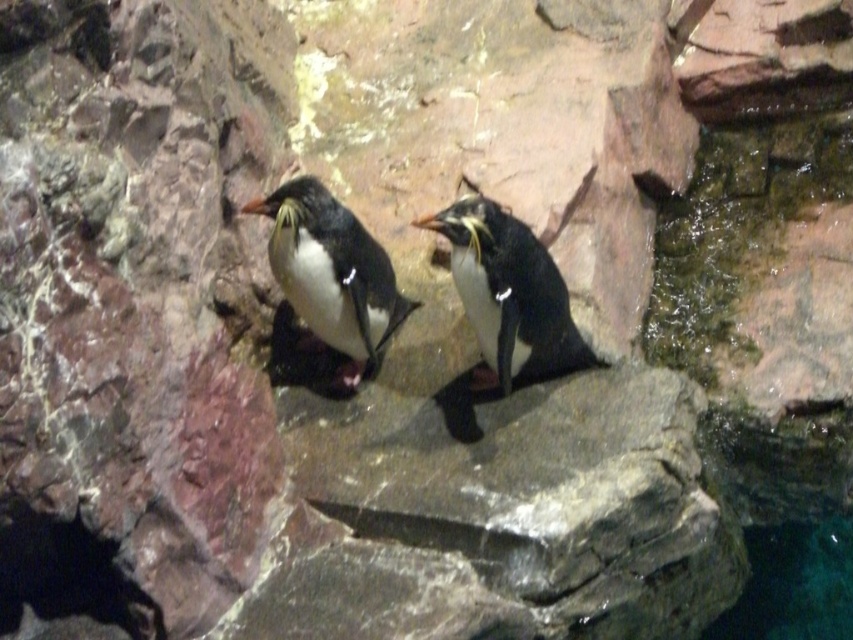
Is point (357, 337) behind point (753, 568)?

No, it is not.

Does white matte penguin at center lie behind clear blue water at lower right?

No, it is in front of clear blue water at lower right.

The width and height of the screenshot is (853, 640). I want to click on white matte penguin at center, so 331,273.

Who is lower down, black matte penguin at center or clear blue water at lower right?

clear blue water at lower right is lower down.

Is point (479, 250) positioned before point (804, 586)?

Yes, it is.

Locate an element on the screen. The width and height of the screenshot is (853, 640). black matte penguin at center is located at coordinates (508, 292).

Between black matte penguin at center and white matte penguin at center, which one appears on the left side from the viewer's perspective?

white matte penguin at center is more to the left.

Find the location of a particular element. black matte penguin at center is located at coordinates (508, 292).

Locate an element on the screen. black matte penguin at center is located at coordinates (508, 292).